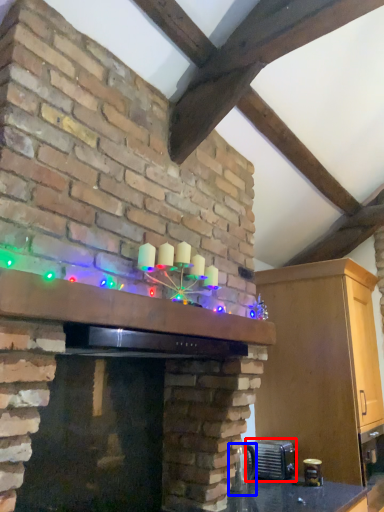
Question: Which object appears closest to the camera in this image, appliance (highlighted by a red box) or appliance (highlighted by a blue box)?

Choices:
 (A) appliance
 (B) appliance

Answer: (B)